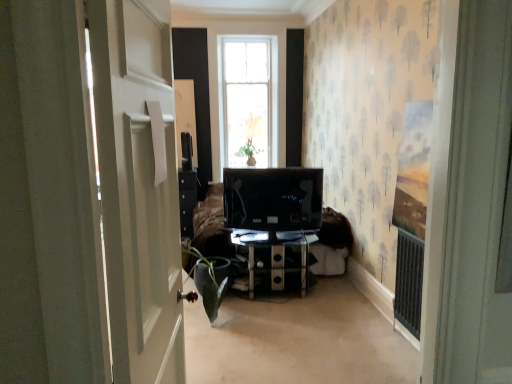
Question: Would you say green matte plant at lower left is outside transparent glass tv stand at center?

Choices:
 (A) yes
 (B) no

Answer: (A)

Question: From the image's perspective, is green matte plant at lower left located above transparent glass tv stand at center?

Choices:
 (A) no
 (B) yes

Answer: (B)

Question: From a real-world perspective, is green matte plant at lower left positioned over transparent glass tv stand at center based on gravity?

Choices:
 (A) no
 (B) yes

Answer: (B)

Question: Does green matte plant at lower left lie in front of transparent glass tv stand at center?

Choices:
 (A) yes
 (B) no

Answer: (A)

Question: Could transparent glass tv stand at center be considered to be inside green matte plant at lower left?

Choices:
 (A) yes
 (B) no

Answer: (B)

Question: Relative to green matte plant at lower left, is matte black monitor at center in front or behind?

Choices:
 (A) front
 (B) behind

Answer: (B)

Question: In terms of height, does matte black monitor at center look taller or shorter compared to green matte plant at lower left?

Choices:
 (A) tall
 (B) short

Answer: (A)

Question: From a real-world perspective, is matte black monitor at center physically located above or below green matte plant at lower left?

Choices:
 (A) above
 (B) below

Answer: (A)

Question: Would you say matte black monitor at center is inside or outside green matte plant at lower left?

Choices:
 (A) outside
 (B) inside

Answer: (A)

Question: Considering the positions of point (300, 178) and point (304, 289), is point (300, 178) closer or farther from the camera than point (304, 289)?

Choices:
 (A) farther
 (B) closer

Answer: (B)

Question: Relative to transparent glass tv stand at center, is matte black monitor at center in front or behind?

Choices:
 (A) behind
 (B) front

Answer: (B)

Question: In the image, is matte black monitor at center on the left side or the right side of transparent glass tv stand at center?

Choices:
 (A) left
 (B) right

Answer: (A)

Question: In terms of width, does matte black monitor at center look wider or thinner when compared to transparent glass tv stand at center?

Choices:
 (A) thin
 (B) wide

Answer: (A)

Question: Is point (202, 258) closer or farther from the camera than point (121, 278)?

Choices:
 (A) farther
 (B) closer

Answer: (A)

Question: Is green matte plant at lower left spatially inside white glossy door at left, or outside of it?

Choices:
 (A) inside
 (B) outside

Answer: (B)